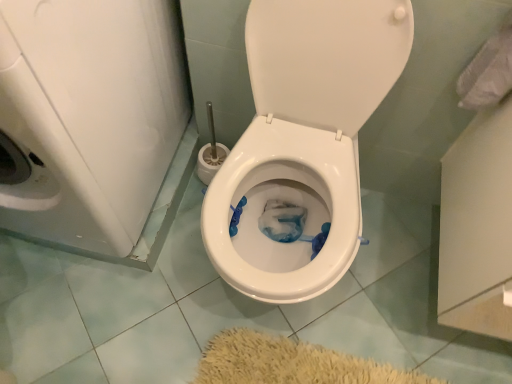
This screenshot has height=384, width=512. Identify the location of white glossy washer at left. (90, 116).

What do you see at coordinates (487, 72) in the screenshot? I see `white fabric at upper right` at bounding box center [487, 72].

Image resolution: width=512 pixels, height=384 pixels. I want to click on white glossy washer at left, so click(x=90, y=116).

How many degrees apart are the facing directions of white fabric at upper right and white glossy washer at left?

white fabric at upper right and white glossy washer at left are facing 0.961 degrees away from each other.

Does white fabric at upper right turn towards white glossy washer at left?

No, white fabric at upper right is not aimed at white glossy washer at left.

Is white fabric at upper right surrounding white glossy washer at left?

Definitely not — white glossy washer at left is not inside white fabric at upper right.

From the image's perspective, is white fabric at upper right below white glossy washer at left?

Actually, white fabric at upper right appears above white glossy washer at left in the image.

Is white glossy washer at left completely or partially outside of white fabric at upper right?

Indeed, white glossy washer at left is completely outside white fabric at upper right.

Consider the image. Is white glossy washer at left in front of white fabric at upper right?

Yes, the depth of white glossy washer at left is less than that of white fabric at upper right.

Is white glossy washer at left bigger than white fabric at upper right?

Indeed, white glossy washer at left has a larger size compared to white fabric at upper right.

From a real-world perspective, between white glossy washer at left and white fabric at upper right, who is vertically higher?

From a 3D spatial view, white fabric at upper right is above.

Is white glossy toilet at center facing away from white fabric at upper right?

That's not correct — white glossy toilet at center is not looking away from white fabric at upper right.

In terms of size, does white glossy toilet at center appear bigger or smaller than white fabric at upper right?

white glossy toilet at center is bigger than white fabric at upper right.

Can you confirm if white glossy toilet at center is taller than white fabric at upper right?

Yes.

From the image's perspective, would you say white glossy toilet at center is shown under white fabric at upper right?

Yes.

Is white glossy washer at left turned away from white glossy toilet at center?

No, white glossy washer at left is not facing away from white glossy toilet at center.

From a real-world perspective, which is physically above, white glossy washer at left or white glossy toilet at center?

In real-world perspective, white glossy washer at left is above.

In the scene shown: Is white glossy washer at left bigger or smaller than white glossy toilet at center?

In the image, white glossy washer at left appears to be larger than white glossy toilet at center.

Find the location of a particular element. washer that is on the left side of white glossy toilet at center is located at coordinates (90, 116).

From the picture: Considering the sizes of white glossy toilet at center and white glossy washer at left in the image, is white glossy toilet at center taller or shorter than white glossy washer at left?

Clearly, white glossy toilet at center is shorter compared to white glossy washer at left.

Could you tell me if white glossy toilet at center is turned towards white glossy washer at left?

No, white glossy toilet at center is not facing towards white glossy washer at left.

Is white glossy toilet at center wider than white glossy washer at left?

Incorrect, the width of white glossy toilet at center does not surpass that of white glossy washer at left.

Between white glossy toilet at center and white glossy washer at left, which one has smaller size?

white glossy toilet at center is smaller.

Is white fabric at upper right taller than white glossy toilet at center?

In fact, white fabric at upper right may be shorter than white glossy toilet at center.

Would you say white fabric at upper right is to the left or to the right of white glossy toilet at center in the picture?

white fabric at upper right is to the right of white glossy toilet at center.

In the scene shown: Is white fabric at upper right in front of or behind white glossy toilet at center in the image?

white fabric at upper right is positioned farther from the viewer than white glossy toilet at center.

How distant is white fabric at upper right from white glossy toilet at center?

white fabric at upper right is 15.35 inches away from white glossy toilet at center.

The height and width of the screenshot is (384, 512). I want to click on toilet paper above the white glossy washer at left (from a real-world perspective), so click(x=487, y=72).

Where is `toilet paper above the white glossy washer at left (from the image's perspective)`? The image size is (512, 384). toilet paper above the white glossy washer at left (from the image's perspective) is located at coordinates (487, 72).

From the image, which object appears to be nearer to white glossy toilet at center, white fabric at upper right or white glossy washer at left?

The object closer to white glossy toilet at center is white glossy washer at left.

Estimate the real-world distances between objects in this image. Which object is further from white glossy washer at left, white fabric at upper right or white glossy toilet at center?

The object further to white glossy washer at left is white fabric at upper right.

Based on their spatial positions, is white glossy washer at left or white glossy toilet at center closer to white fabric at upper right?

Among the two, white glossy toilet at center is located nearer to white fabric at upper right.

Estimate the real-world distances between objects in this image. Which object is further from white fabric at upper right, white glossy toilet at center or white glossy washer at left?

Among the two, white glossy washer at left is located further to white fabric at upper right.

Which object lies further to the anchor point white glossy toilet at center, white glossy washer at left or white fabric at upper right?

Among the two, white fabric at upper right is located further to white glossy toilet at center.

Consider the image. From the image, which object appears to be nearer to white glossy washer at left, white glossy toilet at center or white fabric at upper right?

white glossy toilet at center is positioned closer to the anchor white glossy washer at left.

You are a GUI agent. You are given a task and a screenshot of the screen. Output one action in this format:
    pyautogui.click(x=<x>, y=<y>)
    Task: Click on the toilet situated between white glossy washer at left and white fabric at upper right from left to right
    
    Given the screenshot: What is the action you would take?
    pyautogui.click(x=304, y=138)